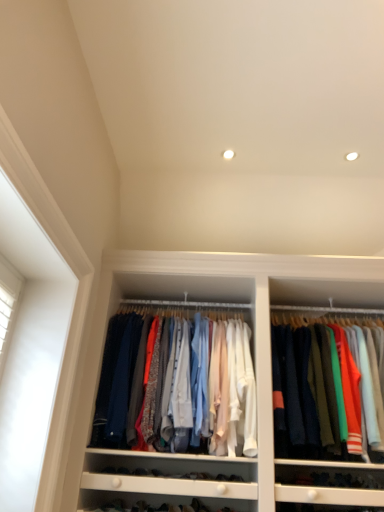
Question: Considering the positions of matte cotton shirts at center, acting as the first clothing starting from the left, and knit sweater at upper right, the 2th clothing when ordered from left to right, in the image, is matte cotton shirts at center, acting as the first clothing starting from the left, wider or thinner than knit sweater at upper right, the 2th clothing when ordered from left to right,?

Choices:
 (A) wide
 (B) thin

Answer: (B)

Question: In terms of size, does matte cotton shirts at center, the second clothing positioned from the right, appear bigger or smaller than knit sweater at upper right, arranged as the first clothing when viewed from the right?

Choices:
 (A) big
 (B) small

Answer: (B)

Question: Is matte cotton shirts at center, acting as the first clothing starting from the left, in front of or behind knit sweater at upper right, arranged as the first clothing when viewed from the right, in the image?

Choices:
 (A) behind
 (B) front

Answer: (A)

Question: Which is correct: knit sweater at upper right, arranged as the first clothing when viewed from the right, is inside matte cotton shirts at center, acting as the first clothing starting from the left, or outside of it?

Choices:
 (A) inside
 (B) outside

Answer: (B)

Question: In terms of height, does knit sweater at upper right, arranged as the first clothing when viewed from the right, look taller or shorter compared to matte cotton shirts at center, acting as the first clothing starting from the left?

Choices:
 (A) short
 (B) tall

Answer: (B)

Question: Looking at the image, does knit sweater at upper right, the 2th clothing when ordered from left to right, seem bigger or smaller compared to matte cotton shirts at center, the second clothing positioned from the right?

Choices:
 (A) big
 (B) small

Answer: (A)

Question: From the image's perspective, is knit sweater at upper right, the 2th clothing when ordered from left to right, positioned above or below matte cotton shirts at center, acting as the first clothing starting from the left?

Choices:
 (A) below
 (B) above

Answer: (A)